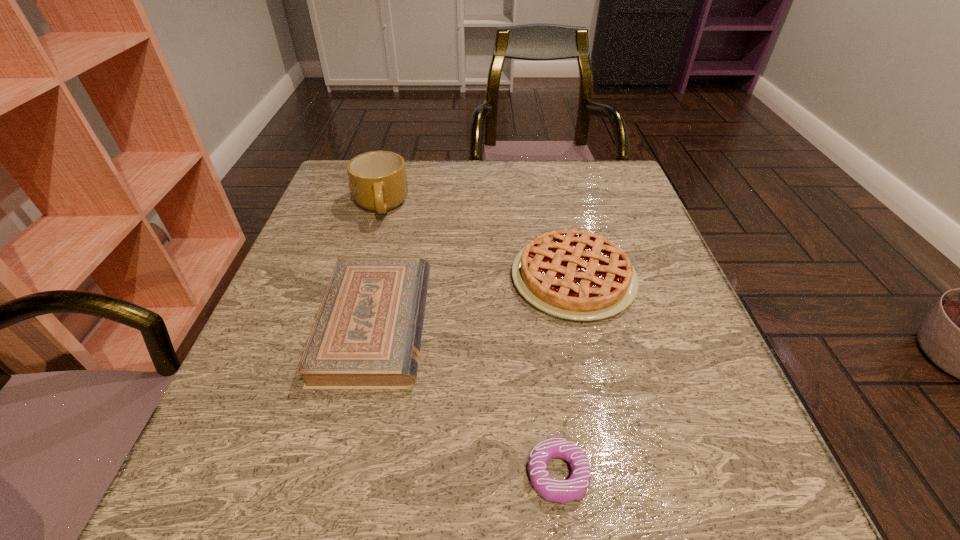
The height and width of the screenshot is (540, 960). I want to click on object present at the far edge, so click(377, 179).

Where is `object at the near edge`? The image size is (960, 540). object at the near edge is located at coordinates (573, 488).

This screenshot has width=960, height=540. Find the location of `mug that is positioned at the left edge`. mug that is positioned at the left edge is located at coordinates (377, 179).

The image size is (960, 540). I want to click on Bible situated at the left edge, so click(x=367, y=334).

Identify the location of object positioned at the right edge. (572, 274).

Find the location of a particular element. object present at the far left corner is located at coordinates (377, 179).

Locate an element on the screen. Image resolution: width=960 pixels, height=540 pixels. vacant space at the far edge of the desktop is located at coordinates (479, 178).

Identify the location of vacant region at the near edge of the desktop. (497, 521).

You are a GUI agent. You are given a task and a screenshot of the screen. Output one action in this format:
    pyautogui.click(x=<x>, y=<y>)
    Task: Click on the free region at the right edge
    
    Given the screenshot: What is the action you would take?
    pyautogui.click(x=723, y=375)

The height and width of the screenshot is (540, 960). I want to click on vacant space at the near left corner, so click(x=293, y=503).